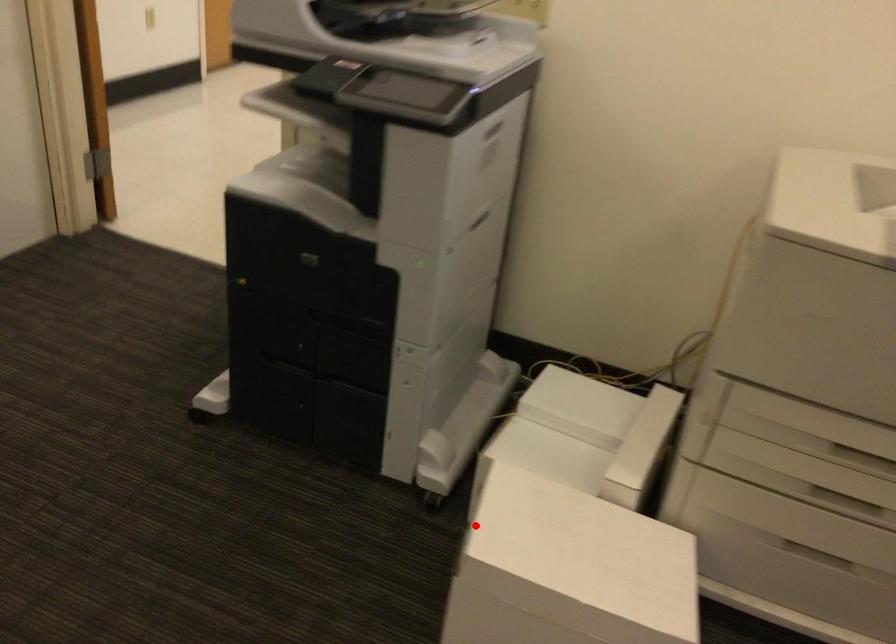
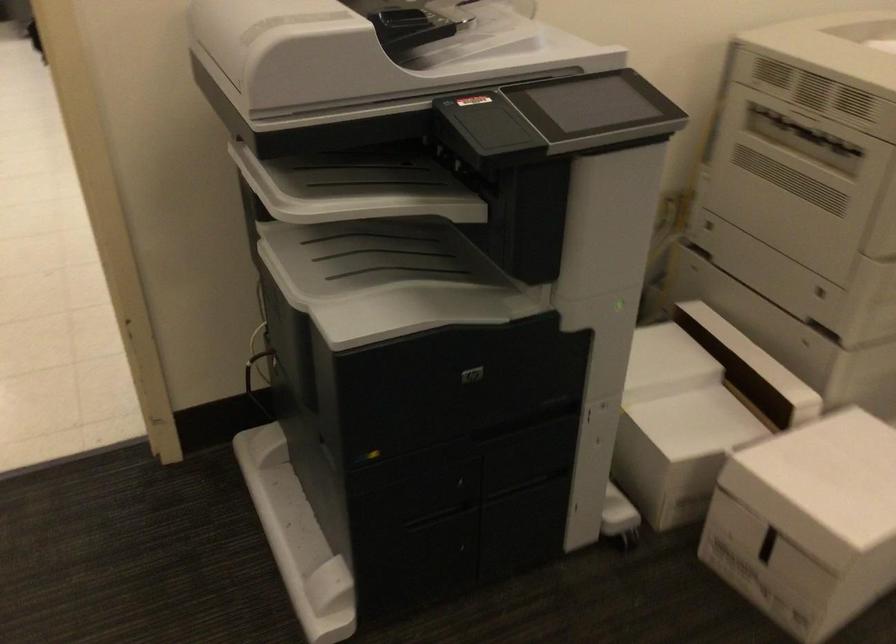
In the second image, find the point that corresponds to the highlighted location in the first image.

(807, 522)